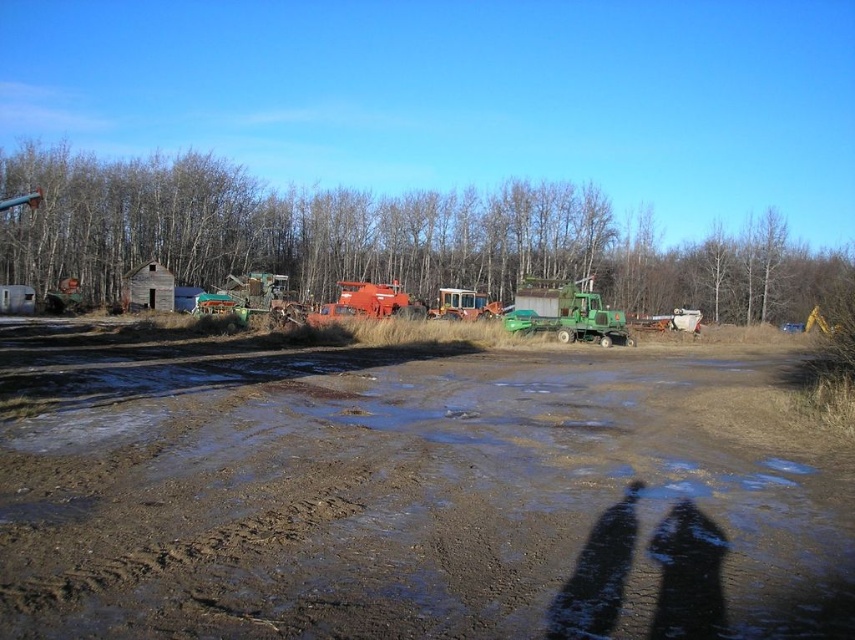
Looking at this image, who is higher up, muddy brown dirt field at center or weathered wood hut at left?

weathered wood hut at left is above.

Which is in front, point (486, 554) or point (152, 284)?

Point (486, 554)

Measure the distance between point (x=369, y=483) and camera.

The distance of point (x=369, y=483) from camera is 7.85 meters.

Locate an element on the screen. This screenshot has height=640, width=855. muddy brown dirt field at center is located at coordinates (408, 496).

Who is more distant from viewer, (157, 392) or (522, 202)?

Point (522, 202)

Can you confirm if muddy brown dirt field at center is positioned below brown wood tree at upper center?

Indeed, muddy brown dirt field at center is positioned under brown wood tree at upper center.

The image size is (855, 640). I want to click on muddy brown dirt field at center, so click(x=408, y=496).

Is brown wood tree at upper center closer to the viewer compared to weathered wood hut at left?

No, brown wood tree at upper center is behind weathered wood hut at left.

Between brown wood tree at upper center and weathered wood hut at left, which one appears on the right side from the viewer's perspective?

brown wood tree at upper center

You are a GUI agent. You are given a task and a screenshot of the screen. Output one action in this format:
    pyautogui.click(x=<x>, y=<y>)
    Task: Click on the brown wood tree at upper center
    Image resolution: width=855 pixels, height=640 pixels.
    Given the screenshot: What is the action you would take?
    pyautogui.click(x=379, y=237)

Image resolution: width=855 pixels, height=640 pixels. Identify the location of brown wood tree at upper center. (379, 237).